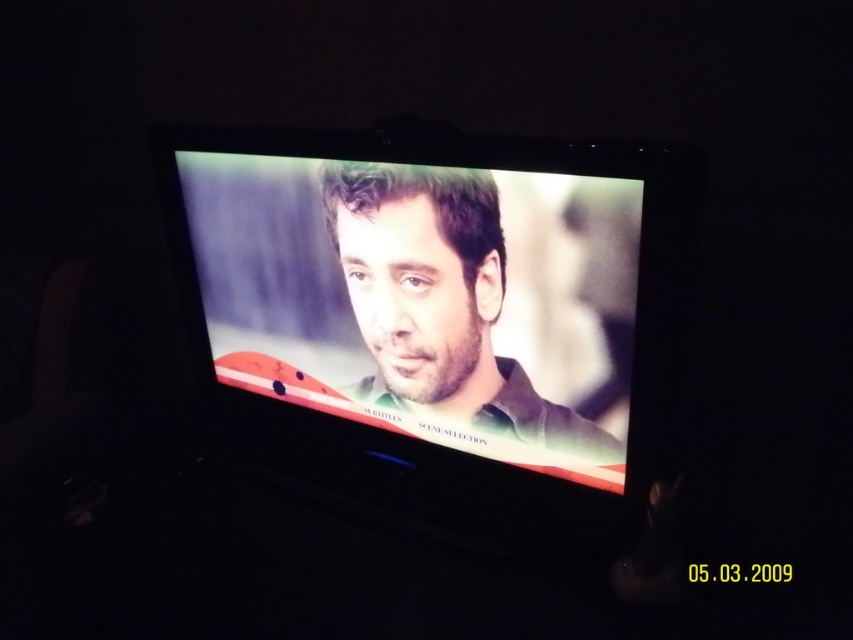
Based on the photo, can you confirm if matte black face at center is smaller than matte green shirt at center?

Incorrect, matte black face at center is not smaller in size than matte green shirt at center.

Who is higher up, matte black face at center or matte green shirt at center?

matte green shirt at center

Who is more forward, (595, 385) or (412, 328)?

Point (595, 385)

At what (x,y) coordinates should I click in order to perform the action: click on matte black face at center. Please return your answer as a coordinate pair (x, y). The image size is (853, 640). Looking at the image, I should click on (439, 301).

Based on the photo, which is more to the right, matte black screen at center or matte green shirt at center?

From the viewer's perspective, matte green shirt at center appears more on the right side.

Does matte black screen at center have a larger size compared to matte green shirt at center?

Yes, matte black screen at center is bigger than matte green shirt at center.

Does point (456, 476) come closer to viewer compared to point (485, 308)?

No, (456, 476) is further to viewer.

This screenshot has width=853, height=640. Find the location of `matte black screen at center`. matte black screen at center is located at coordinates (438, 300).

Which of these two, matte black screen at center or matte black face at center, stands shorter?

With less height is matte black face at center.

Who is more forward, (x=554, y=401) or (x=459, y=262)?

Point (x=459, y=262) is more forward.

Between point (450, 218) and point (466, 397), which one is positioned behind?

The point (466, 397) is behind.

At what (x,y) coordinates should I click in order to perform the action: click on matte black screen at center. Please return your answer as a coordinate pair (x, y). The image size is (853, 640). Looking at the image, I should click on (438, 300).